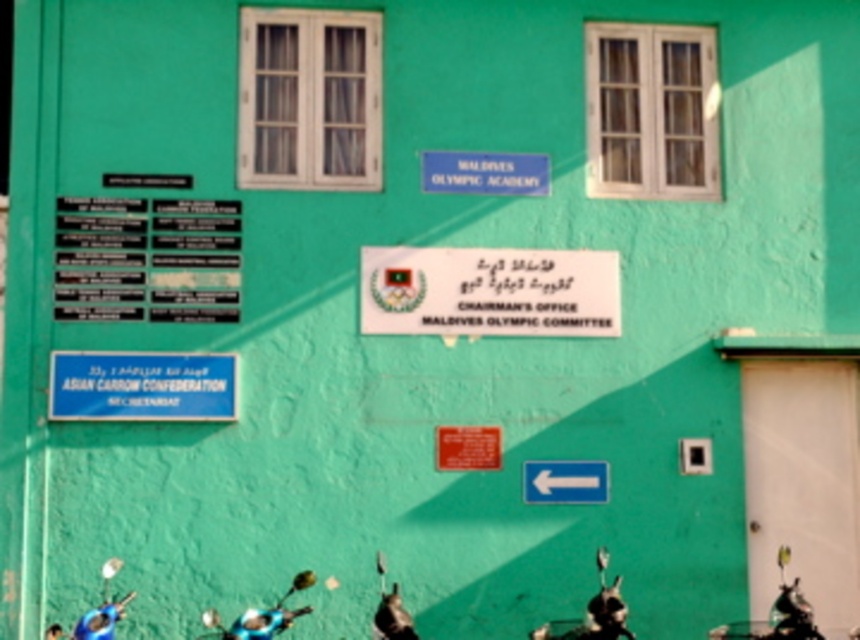
Question: Which of the following is the closest to the observer?

Choices:
 (A) (617, 596)
 (B) (287, 588)

Answer: (A)

Question: Does shiny chrome motorcycle at lower center have a larger size compared to blue matte motorcycle at lower center?

Choices:
 (A) yes
 (B) no

Answer: (A)

Question: Which point appears closest to the camera in this image?

Choices:
 (A) (607, 586)
 (B) (292, 582)

Answer: (B)

Question: Where is shiny chrome motorcycle at lower center located in relation to blue matte motorcycle at lower center in the image?

Choices:
 (A) left
 (B) right

Answer: (B)

Question: Can you confirm if shiny chrome motorcycle at lower center is thinner than blue matte motorcycle at lower center?

Choices:
 (A) yes
 (B) no

Answer: (A)